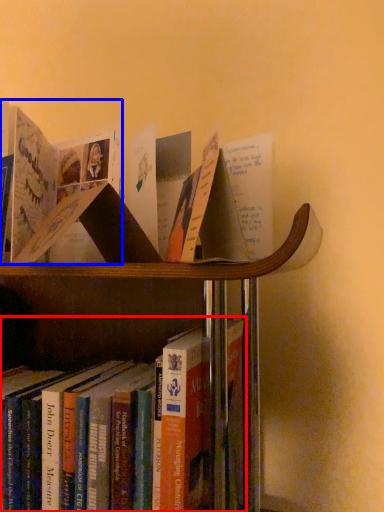
Question: Which object is further to the camera taking this photo, book (highlighted by a red box) or book (highlighted by a blue box)?

Choices:
 (A) book
 (B) book

Answer: (B)